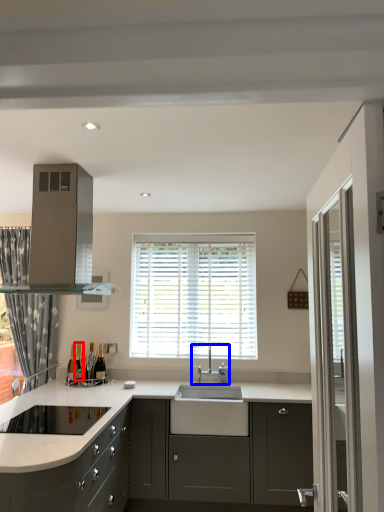
Question: Which point is further to the camera, wine bottle (highlighted by a red box) or tap (highlighted by a blue box)?

Choices:
 (A) wine bottle
 (B) tap

Answer: (A)